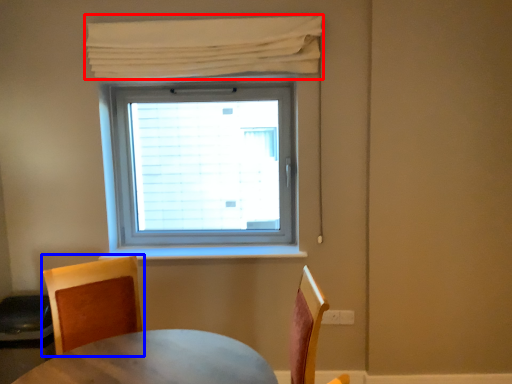
Question: Which object appears farthest to the camera in this image, curtain (highlighted by a red box) or chair (highlighted by a blue box)?

Choices:
 (A) curtain
 (B) chair

Answer: (A)